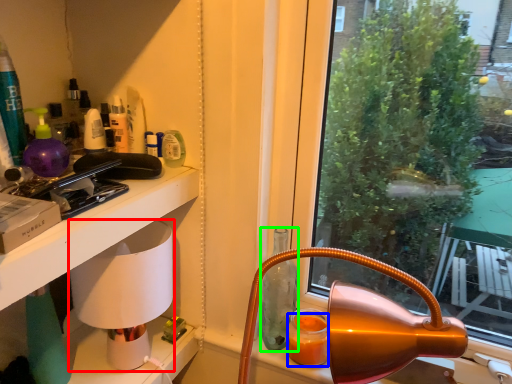
Question: Based on their relative distances, which object is farther from oil lamp (highlighted by a red box)? Choose from orange juice (highlighted by a blue box) and bottle (highlighted by a green box).

Choices:
 (A) orange juice
 (B) bottle

Answer: (A)